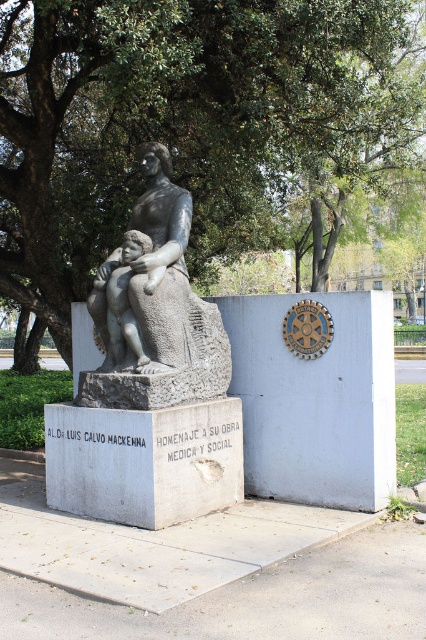
In the scene shown: Is matte gray stone statue at center positioned at the back of matte gray statue at center?

That is False.

Does matte gray stone statue at center have a lesser width compared to matte gray statue at center?

In fact, matte gray stone statue at center might be wider than matte gray statue at center.

This screenshot has height=640, width=426. I want to click on matte gray stone statue at center, so click(155, 308).

Between green leafy tree at upper center and matte gray stone statue at center, which one appears on the left side from the viewer's perspective?

green leafy tree at upper center is more to the left.

Does green leafy tree at upper center appear on the left side of matte gray stone statue at center?

Indeed, green leafy tree at upper center is positioned on the left side of matte gray stone statue at center.

Is point (20, 292) in front of point (186, 278)?

No.

This screenshot has height=640, width=426. I want to click on green leafy tree at upper center, so coord(186,120).

Between green leafy tree at upper center and matte gray statue at center, which one appears on the left side from the viewer's perspective?

Positioned to the left is green leafy tree at upper center.

This screenshot has height=640, width=426. Identify the location of green leafy tree at upper center. (186, 120).